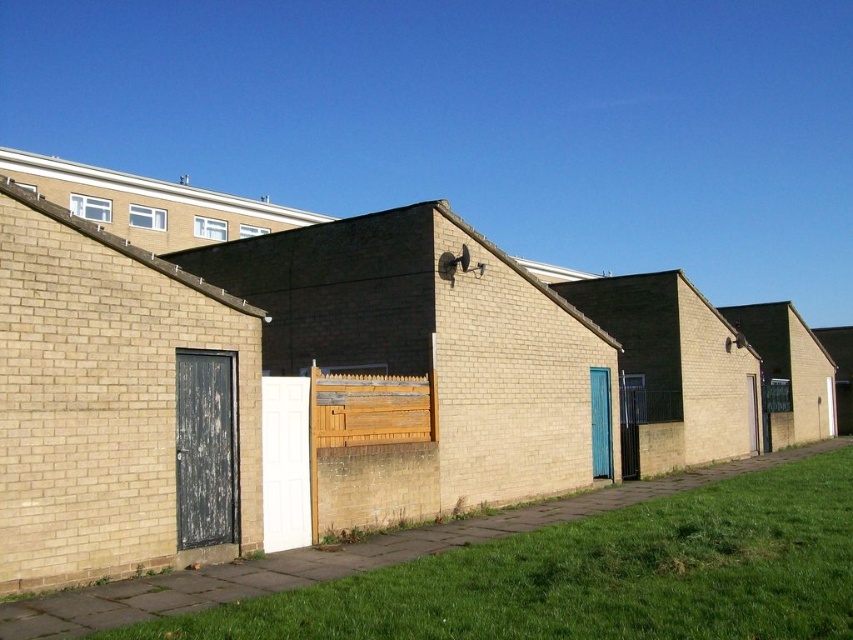
Question: Does weathered wood door at left appear on the right side of weathered wood fence at center?

Choices:
 (A) no
 (B) yes

Answer: (A)

Question: Can you confirm if weathered wood door at left is positioned to the left of weathered wood fence at center?

Choices:
 (A) no
 (B) yes

Answer: (B)

Question: Estimate the real-world distances between objects in this image. Which object is farther from the weathered wood door at left?

Choices:
 (A) green grass at lower right
 (B) weathered wood fence at center

Answer: (A)

Question: Based on their relative distances, which object is farther from the weathered wood fence at center?

Choices:
 (A) weathered wood door at left
 (B) green grass at lower right

Answer: (B)

Question: Which object appears farthest from the camera in this image?

Choices:
 (A) green grass at lower right
 (B) weathered wood fence at center

Answer: (B)

Question: Is green grass at lower right smaller than weathered wood fence at center?

Choices:
 (A) no
 (B) yes

Answer: (A)